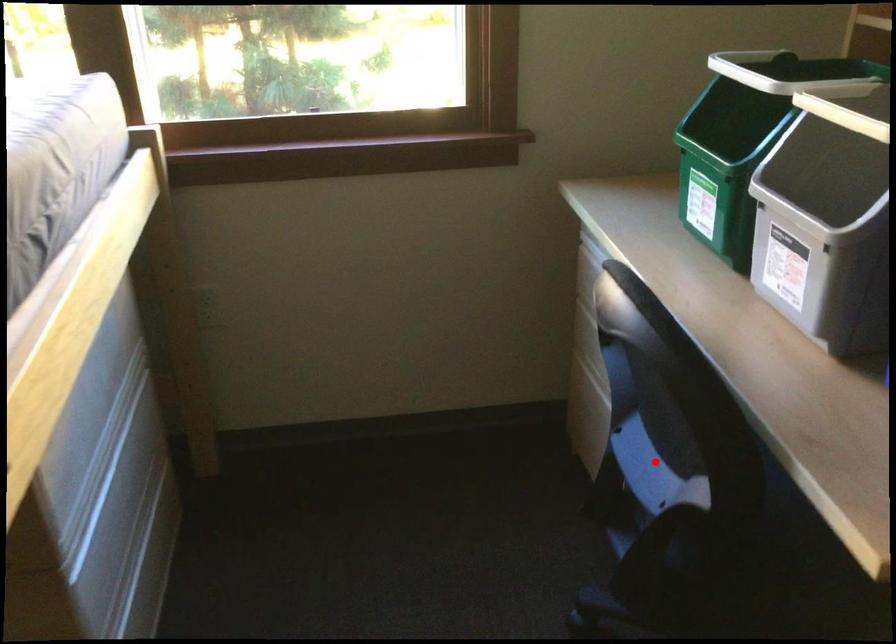
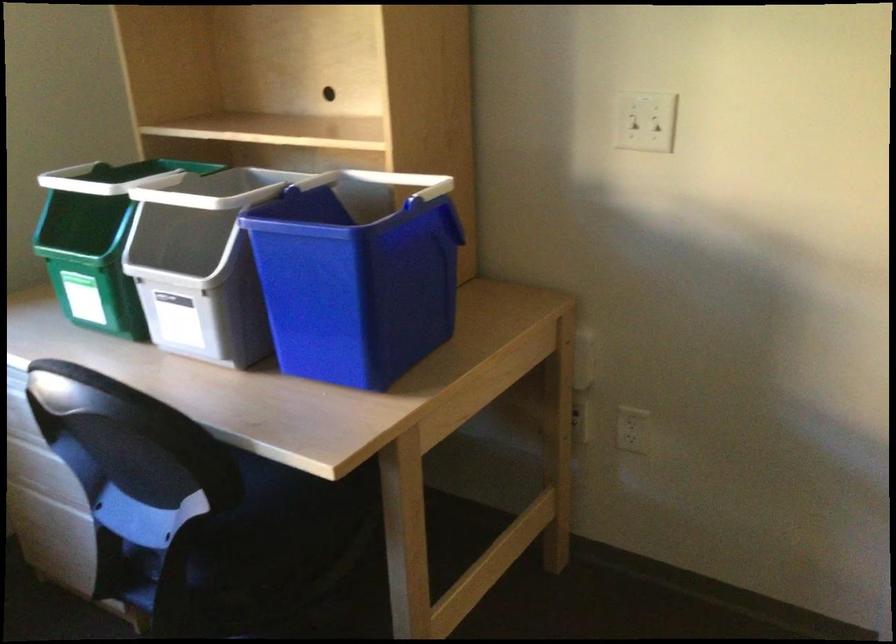
Find the pixel in the second image that matches the highlighted location in the first image.

(151, 518)